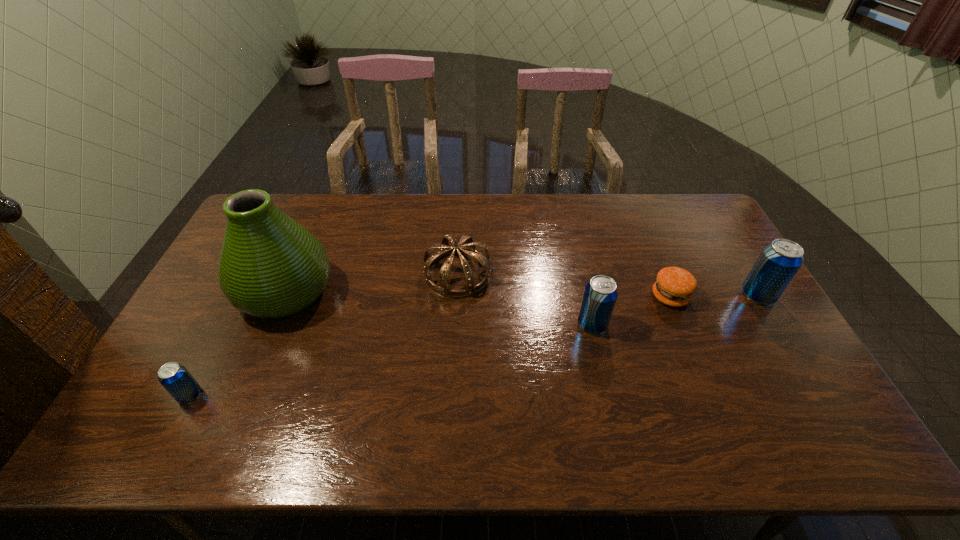
I want to click on object that is at the near left corner, so click(174, 377).

Where is `vacant area at the far edge`? vacant area at the far edge is located at coordinates (391, 197).

In the image, there is a desktop. At what (x,y) coordinates should I click in order to perform the action: click on free space at the near edge. Please return your answer as a coordinate pair (x, y). Looking at the image, I should click on (437, 378).

I want to click on vacant region at the right edge of the desktop, so click(x=705, y=251).

In the image, there is a desktop. Where is `blank space at the far left corner`? The width and height of the screenshot is (960, 540). blank space at the far left corner is located at coordinates (287, 212).

Where is `free space at the far right corner`? Image resolution: width=960 pixels, height=540 pixels. free space at the far right corner is located at coordinates (671, 194).

Find the location of `free space between the tallest object and the second tallest beer can`. free space between the tallest object and the second tallest beer can is located at coordinates (439, 308).

The height and width of the screenshot is (540, 960). I want to click on free spot between the patty and the second beer can from left to right, so click(631, 310).

Where is `free area in between the patty and the second tallest beer can`? The width and height of the screenshot is (960, 540). free area in between the patty and the second tallest beer can is located at coordinates (631, 310).

The height and width of the screenshot is (540, 960). In order to click on free spot between the rightmost beer can and the second farthest beer can in this screenshot , I will do `click(675, 310)`.